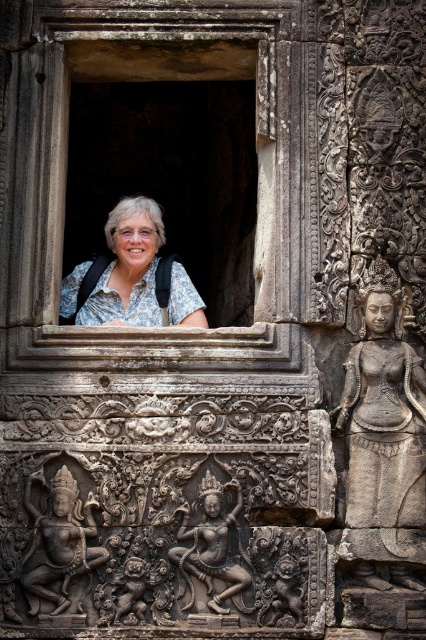
You are a tourist standing in front of the ancient temple. You see the stone window at center and the white floral shirt at center. Which object is closer to you?

The stone window at center is closer to you than the white floral shirt at center because it is further to the viewer.